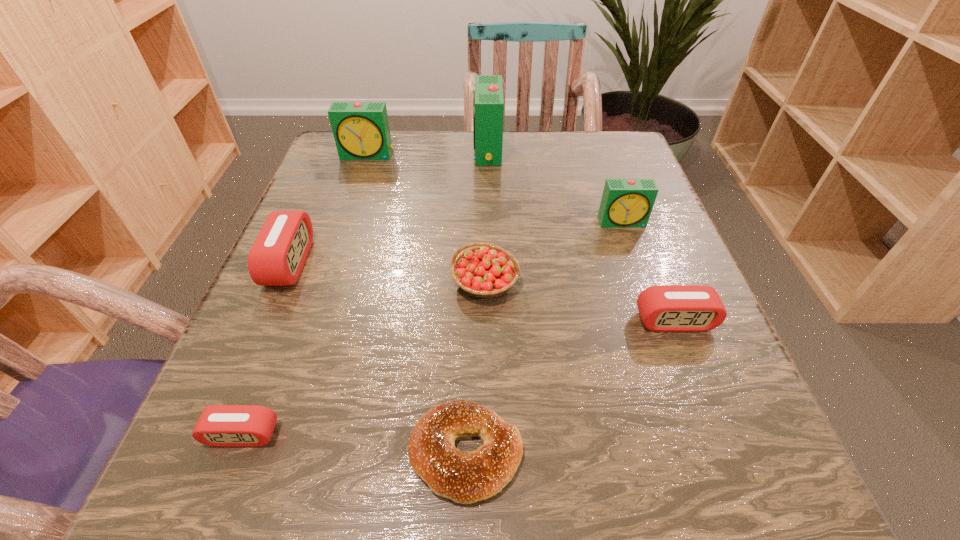
In order to click on the fourth alarm clock from left to right in this screenshot , I will do `click(488, 102)`.

The image size is (960, 540). Identify the location of the tallest object. (488, 102).

Where is `the leftmost green alarm clock`? This screenshot has height=540, width=960. the leftmost green alarm clock is located at coordinates (361, 131).

Find the location of a particular element. the second biggest green alarm clock is located at coordinates (361, 131).

Where is `the third farthest object`? The width and height of the screenshot is (960, 540). the third farthest object is located at coordinates (626, 203).

At what (x,y) coordinates should I click in order to perform the action: click on the smallest green alarm clock. Please return your answer as a coordinate pair (x, y). The image size is (960, 540). Looking at the image, I should click on [626, 203].

The height and width of the screenshot is (540, 960). What are the coordinates of `brown strawberry` in the screenshot? It's located at (486, 270).

Find the location of a particular element. the farthest pink alarm clock is located at coordinates (277, 256).

Where is `the fourth shortest object`? the fourth shortest object is located at coordinates (277, 256).

In order to click on the sixth tallest object in this screenshot , I will do `click(666, 308)`.